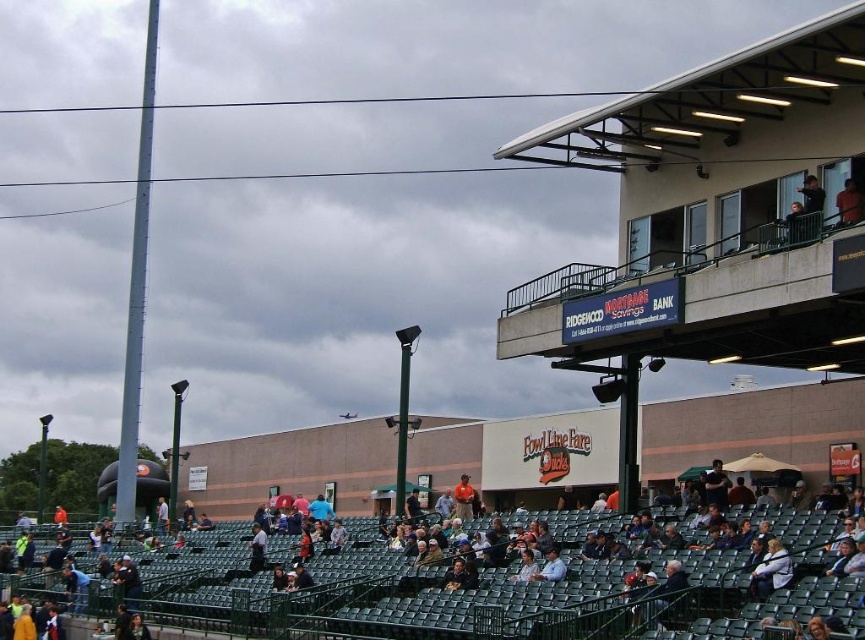
You are a spectator at the baseball stadium. You notice the dark gray seats at lower center and the light brown leather jacket at lower right. Which object is closer to you?

The dark gray seats at lower center are closer to you because they are positioned in front of the light brown leather jacket at lower right.

In the scene shown: You are a photographer trying to capture a photo of the orange shirt at upper right and the light brown leather jacket at lower center. Which of the two objects should you focus on first if you want to ensure both are in the frame without moving the camera?

The orange shirt at upper right is much taller than the light brown leather jacket at lower center, so focusing on the orange shirt at upper right first would help ensure both are in the frame since it occupies more vertical space.